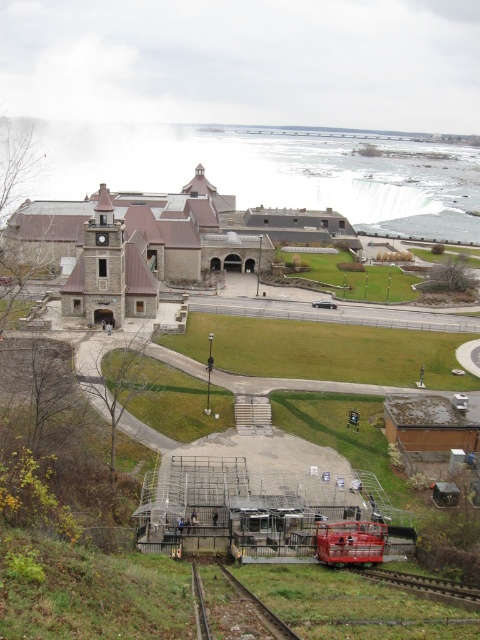
You are a maintenance worker needing to inspect the metallic red train at center and the metallic smooth train track at lower right. Since you have a ladder that can reach up to 2 meters, can you safely access the top of both objects without needing a taller ladder?

The metallic red train at center has a lesser height compared to metallic smooth train track at lower right. Since the ladder can reach up to 2 meters, you can safely access both objects if the height of the metallic smooth train track at lower right is within the ladder reach. However, the description only states the train is shorter than the track, but does not specify exact measurements. Without knowing the exact height of the track, it is uncertain if the ladder is sufficient.

From the picture: You are a tourist standing at the entrance of the historic building and want to take a photo of the metallic rail at lower center and the metallic smooth train track at lower right. Which object should you position to your left side in the frame to capture both in the scene?

To capture both the metallic rail at lower center and the metallic smooth train track at lower right in the frame, you should position the metallic rail at lower center to your left side since it is located to the left of the metallic smooth train track at lower right.